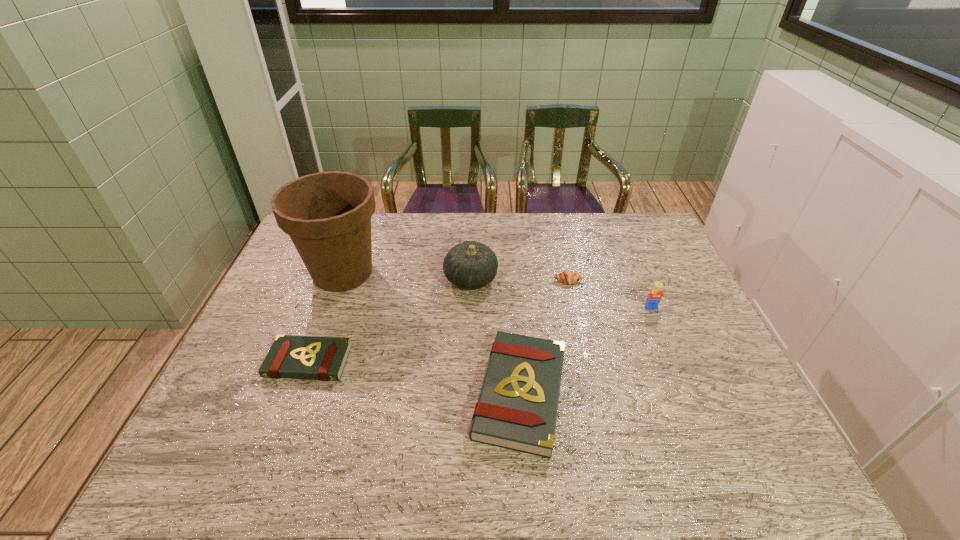
Locate an element on the screen. The width and height of the screenshot is (960, 540). object that is at the far left corner is located at coordinates (327, 215).

Locate an element on the screen. The height and width of the screenshot is (540, 960). free spot at the far edge of the desktop is located at coordinates (571, 228).

The height and width of the screenshot is (540, 960). What are the coordinates of `vacant area at the near edge` in the screenshot? It's located at (463, 426).

Image resolution: width=960 pixels, height=540 pixels. What are the coordinates of `vacant space at the left edge of the desktop` in the screenshot? It's located at (273, 380).

You are a GUI agent. You are given a task and a screenshot of the screen. Output one action in this format:
    pyautogui.click(x=<x>, y=<y>)
    Task: Click on the free space at the right edge
    The width and height of the screenshot is (960, 540).
    Given the screenshot: What is the action you would take?
    pyautogui.click(x=693, y=346)

This screenshot has width=960, height=540. Find the location of `vacant region at the near left corner of the desktop`. vacant region at the near left corner of the desktop is located at coordinates (203, 428).

Find the location of a particular element. The image size is (960, 540). free region at the far right corner of the desktop is located at coordinates (623, 237).

Identify the location of vacant space at the near right corner of the desktop. This screenshot has height=540, width=960. (729, 402).

Locate an element on the screen. The width and height of the screenshot is (960, 540). free spot between the third nearest object and the tallest object is located at coordinates (497, 291).

At what (x,y) coordinates should I click in order to perform the action: click on empty space that is in between the tallest object and the fifth shortest object. Please return your answer as a coordinate pair (x, y). Looking at the image, I should click on (407, 276).